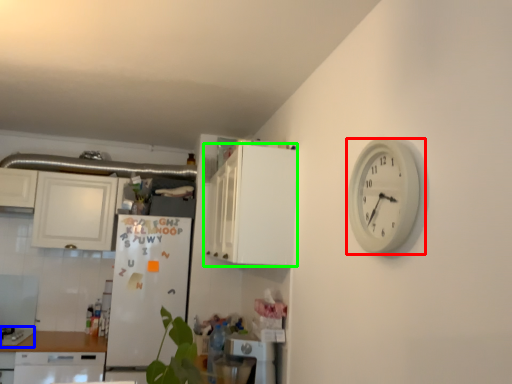
Question: Which is farther away from wall clock (highlighted by a red box)? gas stove (highlighted by a blue box) or cabinetry (highlighted by a green box)?

Choices:
 (A) gas stove
 (B) cabinetry

Answer: (A)